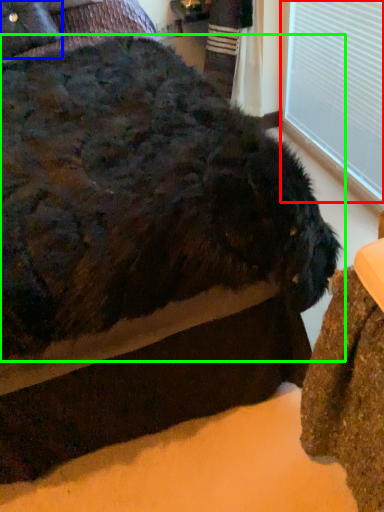
Question: Which object is positioned closest to window frame (highlighted by a red box)? Select from pillow (highlighted by a blue box) and dog (highlighted by a green box).

Choices:
 (A) pillow
 (B) dog

Answer: (B)